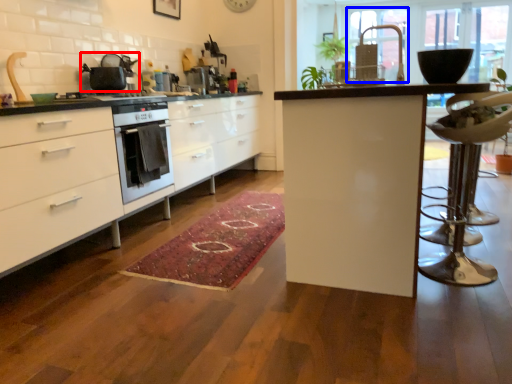
Question: Which object appears closest to the camera in this image, kitchen appliance (highlighted by a red box) or window screen (highlighted by a blue box)?

Choices:
 (A) kitchen appliance
 (B) window screen

Answer: (B)